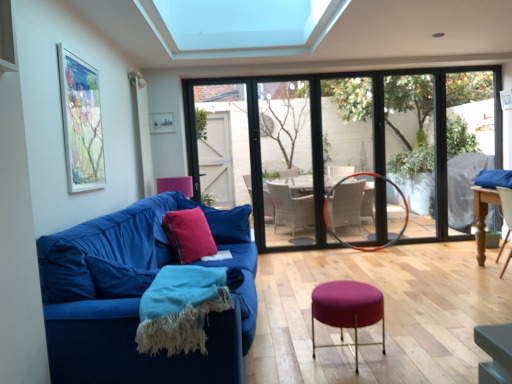
Question: Considering their positions, is velvet red cushion at center left located in front of or behind purple fabric stool at center?

Choices:
 (A) behind
 (B) front

Answer: (A)

Question: Looking at the image, does velvet red cushion at center left seem bigger or smaller compared to purple fabric stool at center?

Choices:
 (A) small
 (B) big

Answer: (A)

Question: Which of these objects is positioned farthest from the orange metallic hula hoop at center?

Choices:
 (A) purple fabric stool at center
 (B) clear glass window screen at right
 (C) matte glass picture frame at upper center, the 2th picture frame when ordered from front to back
 (D) clear glass door at center
 (E) wooden table at right

Answer: (A)

Question: Which is nearer to the wooden table at right?

Choices:
 (A) velvet red cushion at center left
 (B) purple fabric stool at center
 (C) transparent glass window at center
 (D) turquoise woven blanket at lower left
 (E) clear glass door at center

Answer: (C)